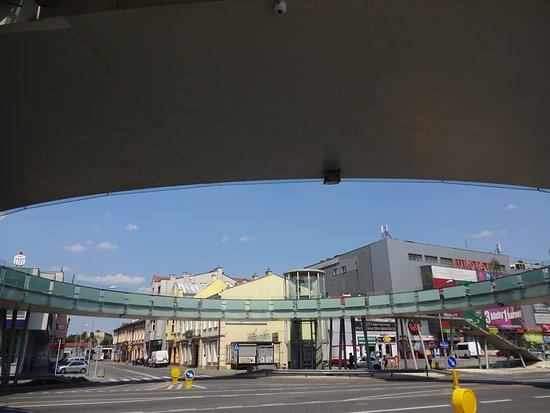
This screenshot has width=550, height=413. Identify the location of window. (302, 281).